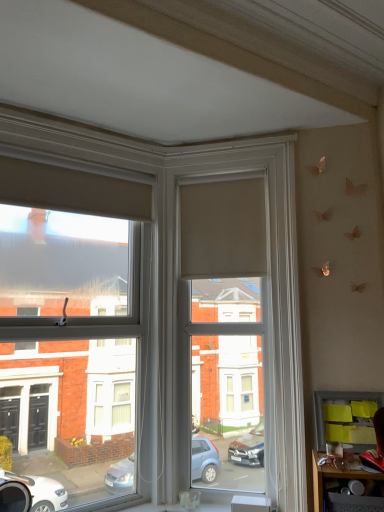
Question: Considering the relative positions of matte beige roller blind at center and yellow sticky notes at lower right in the image provided, is matte beige roller blind at center to the left of yellow sticky notes at lower right from the viewer's perspective?

Choices:
 (A) no
 (B) yes

Answer: (B)

Question: From a real-world perspective, is matte beige roller blind at center on yellow sticky notes at lower right?

Choices:
 (A) yes
 (B) no

Answer: (A)

Question: Is matte beige roller blind at center not near yellow sticky notes at lower right?

Choices:
 (A) yes
 (B) no

Answer: (A)

Question: Is matte beige roller blind at center located outside yellow sticky notes at lower right?

Choices:
 (A) no
 (B) yes

Answer: (B)

Question: Considering the relative sizes of matte beige roller blind at center and yellow sticky notes at lower right in the image provided, is matte beige roller blind at center taller than yellow sticky notes at lower right?

Choices:
 (A) no
 (B) yes

Answer: (B)

Question: Would you say yellow sticky notes at lower right is part of matte beige roller blind at center's contents?

Choices:
 (A) yes
 (B) no

Answer: (B)

Question: From a real-world perspective, is matte black table at lower right over yellow sticky notes at lower right?

Choices:
 (A) yes
 (B) no

Answer: (B)

Question: Is matte black table at lower right positioned beyond the bounds of yellow sticky notes at lower right?

Choices:
 (A) no
 (B) yes

Answer: (B)

Question: Is matte black table at lower right with yellow sticky notes at lower right?

Choices:
 (A) yes
 (B) no

Answer: (B)

Question: Considering the relative sizes of matte black table at lower right and yellow sticky notes at lower right in the image provided, is matte black table at lower right thinner than yellow sticky notes at lower right?

Choices:
 (A) no
 (B) yes

Answer: (A)

Question: From the image's perspective, is matte black table at lower right located above yellow sticky notes at lower right?

Choices:
 (A) no
 (B) yes

Answer: (A)

Question: Considering the relative sizes of matte black table at lower right and yellow sticky notes at lower right in the image provided, is matte black table at lower right taller than yellow sticky notes at lower right?

Choices:
 (A) no
 (B) yes

Answer: (A)

Question: Is yellow sticky notes at lower right directly adjacent to matte beige roller blind at center?

Choices:
 (A) no
 (B) yes

Answer: (A)